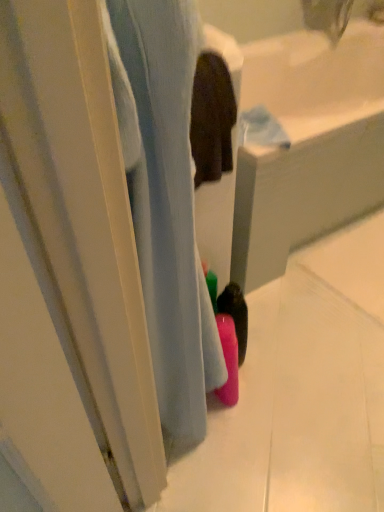
Question: Looking at the image, does pink matte bottle at center, the 1th bath viewed from the back, seem bigger or smaller compared to pink matte bottle at lower center, arranged as the 1th bath when viewed from the front?

Choices:
 (A) big
 (B) small

Answer: (A)

Question: From the image's perspective, relative to pink matte bottle at lower center, arranged as the 1th bath when viewed from the front, is pink matte bottle at center, the 1th bath viewed from the back, above or below?

Choices:
 (A) above
 (B) below

Answer: (A)

Question: Is pink matte bottle at center, the 1th bath viewed from the back, situated inside pink matte bottle at lower center, which is the 2th bath in back-to-front order, or outside?

Choices:
 (A) inside
 (B) outside

Answer: (B)

Question: Is point (178, 79) closer or farther from the camera than point (274, 214)?

Choices:
 (A) closer
 (B) farther

Answer: (A)

Question: From a real-world perspective, relative to pink matte bottle at center, the 1th bath viewed from the back, is pink matte bottle at lower center, arranged as the 1th bath when viewed from the front, vertically above or below?

Choices:
 (A) below
 (B) above

Answer: (B)

Question: Is pink matte bottle at lower center, which is the 2th bath in back-to-front order, taller or shorter than pink matte bottle at center, the second bath viewed from the front?

Choices:
 (A) short
 (B) tall

Answer: (B)

Question: Considering the positions of pink matte bottle at lower center, which is the 2th bath in back-to-front order, and pink matte bottle at center, the 1th bath viewed from the back, in the image, is pink matte bottle at lower center, which is the 2th bath in back-to-front order, bigger or smaller than pink matte bottle at center, the 1th bath viewed from the back,?

Choices:
 (A) small
 (B) big

Answer: (A)